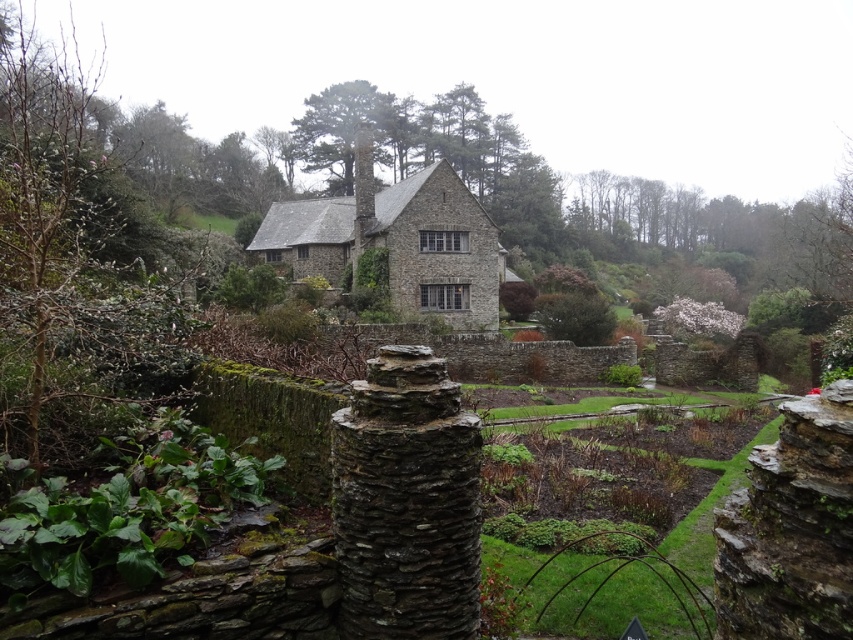
Can you confirm if rustic stone pillar at center is positioned above stone cottage at center?

No.

Can you confirm if rustic stone pillar at center is positioned below stone cottage at center?

Indeed, rustic stone pillar at center is positioned under stone cottage at center.

What do you see at coordinates (405, 500) in the screenshot?
I see `rustic stone pillar at center` at bounding box center [405, 500].

This screenshot has width=853, height=640. In order to click on rustic stone pillar at center in this screenshot , I will do `click(405, 500)`.